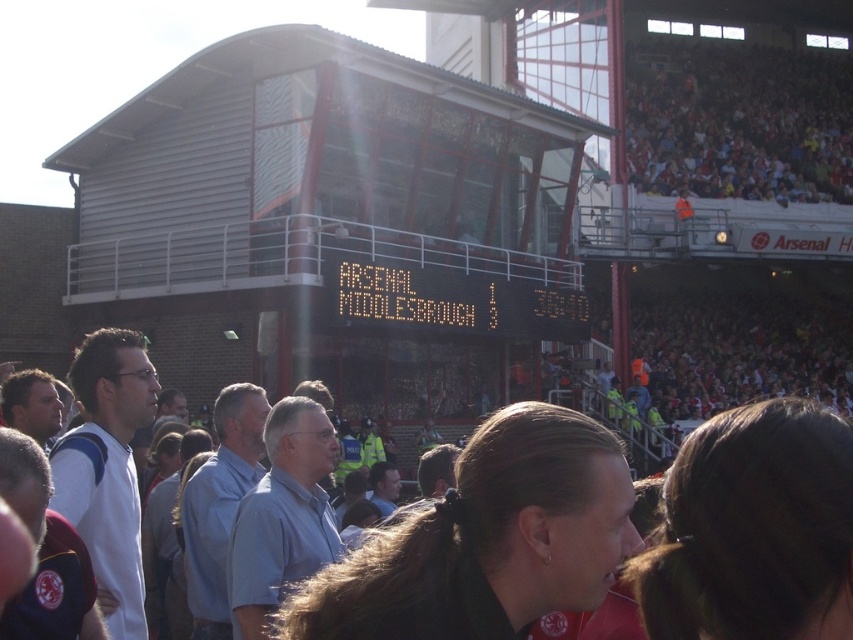
Between red fabric crowd at upper right and orange digital scoreboard at center, which one is positioned lower?

Positioned lower is orange digital scoreboard at center.

Image resolution: width=853 pixels, height=640 pixels. Identify the location of red fabric crowd at upper right. (740, 122).